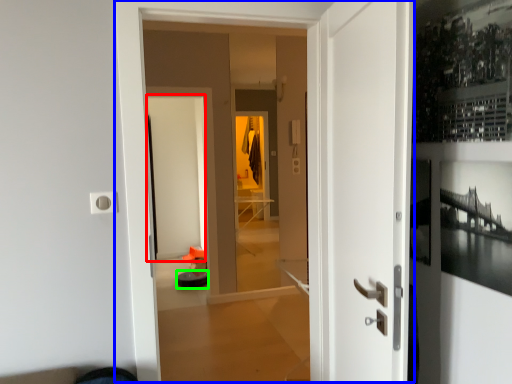
Question: Which is farther away from screen door (highlighted by a red box)? door (highlighted by a blue box) or furniture (highlighted by a green box)?

Choices:
 (A) door
 (B) furniture

Answer: (A)